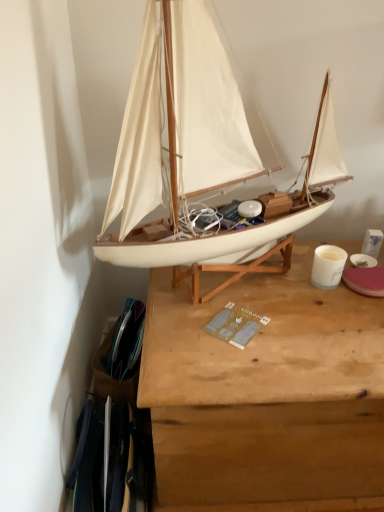
Find the location of `free spot below white matte sailboat at center (from a real-world perspective)`. free spot below white matte sailboat at center (from a real-world perspective) is located at coordinates pos(251,284).